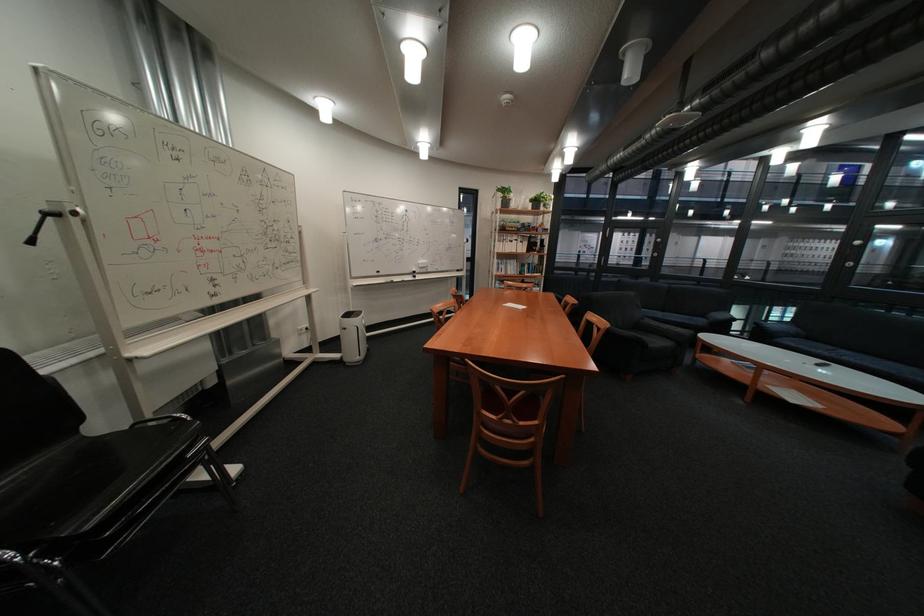
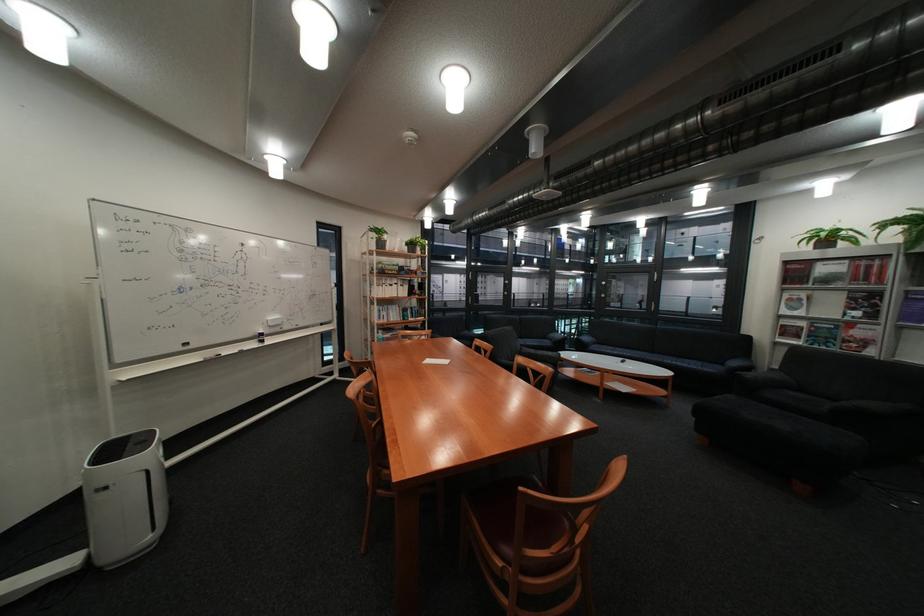
In the second image, find the point that corresponds to pixel 434 262 in the first image.

(284, 318)